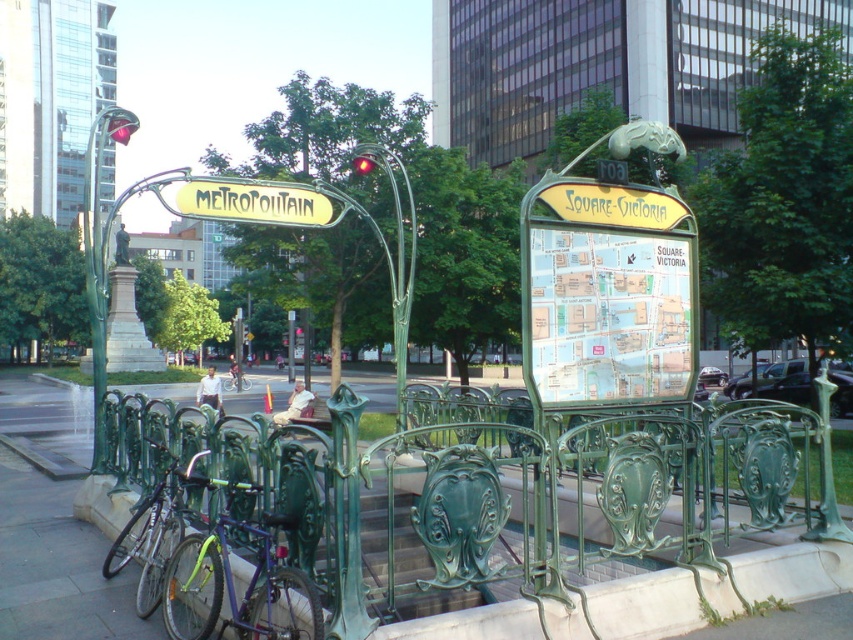
You are a delivery person trying to park your green matte bicycle at center near the metro entrance. The green wrought iron fence at center is in the way. Can you fit your bicycle next to the fence without moving it?

The green wrought iron fence at center has a lesser width compared to green matte bicycle at center. Since the fence is narrower than the bicycle, there might not be enough space to park the bicycle next to it without moving the fence.

From the picture: You are a delivery person who needs to load a package onto your bicycle. You have two bicycles available here, the purple matte bicycle at center and the green matte bicycle at lower left. The package requires at least 24 inches of space between the bicycles to be safely loaded. Can you load the package between them?

The purple matte bicycle at center and the green matte bicycle at lower left are 23.56 inches apart from each other. Since the required space is 24 inches, the distance is insufficient. Therefore, you cannot safely load the package between them.